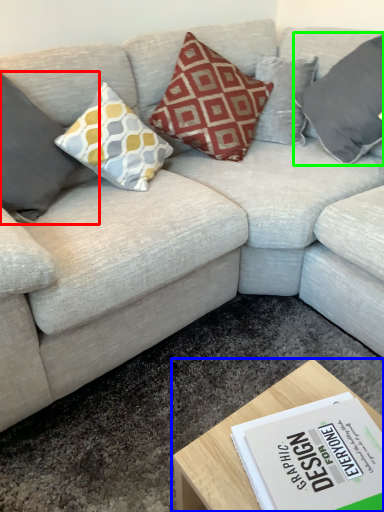
Question: Considering the real-world distances, which object is farthest from pillow (highlighted by a red box)? coffee table (highlighted by a blue box) or pillow (highlighted by a green box)?

Choices:
 (A) coffee table
 (B) pillow

Answer: (B)